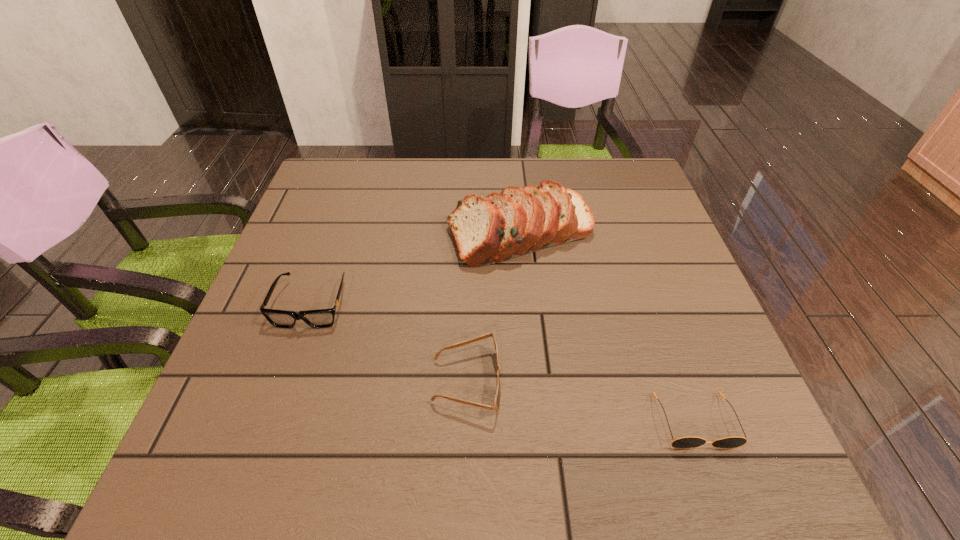
Find the location of a particular element. The height and width of the screenshot is (540, 960). object that is at the far edge is located at coordinates (518, 221).

Where is `object present at the near edge`? Image resolution: width=960 pixels, height=540 pixels. object present at the near edge is located at coordinates (685, 442).

Locate an element on the screen. The height and width of the screenshot is (540, 960). object located in the left edge section of the desktop is located at coordinates (322, 318).

Locate an element on the screen. The width and height of the screenshot is (960, 540). object that is at the right edge is located at coordinates (685, 442).

Locate an element on the screen. The width and height of the screenshot is (960, 540). object present at the near right corner is located at coordinates (685, 442).

Where is `free region at the far edge of the desktop`? free region at the far edge of the desktop is located at coordinates (502, 169).

You are a GUI agent. You are given a task and a screenshot of the screen. Output one action in this format:
    pyautogui.click(x=<x>, y=<y>)
    Task: Click on the vacant space at the near edge of the desktop
    This screenshot has width=960, height=540.
    Given the screenshot: What is the action you would take?
    pyautogui.click(x=293, y=455)

This screenshot has height=540, width=960. I want to click on free space at the left edge, so click(x=265, y=354).

I want to click on free space at the right edge of the desktop, so click(654, 298).

In the image, there is a desktop. Where is `free space at the far left corner`? free space at the far left corner is located at coordinates [374, 169].